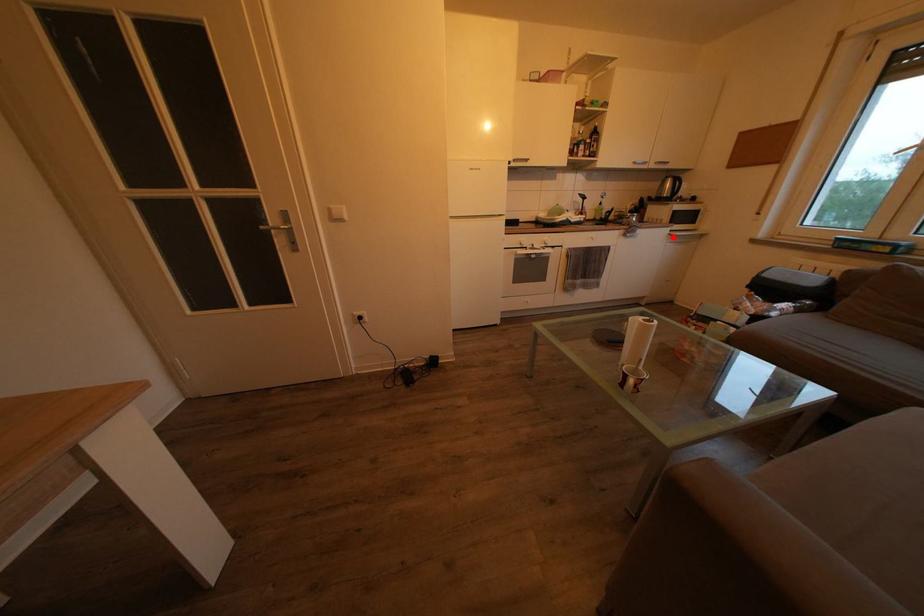
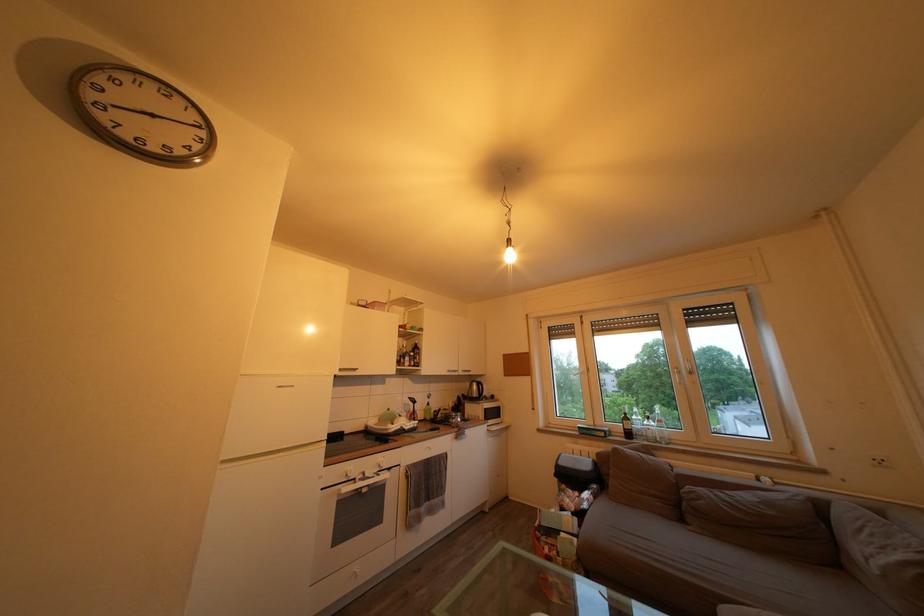
In the second image, find the point that corresponds to the highlighted location in the first image.

(492, 434)